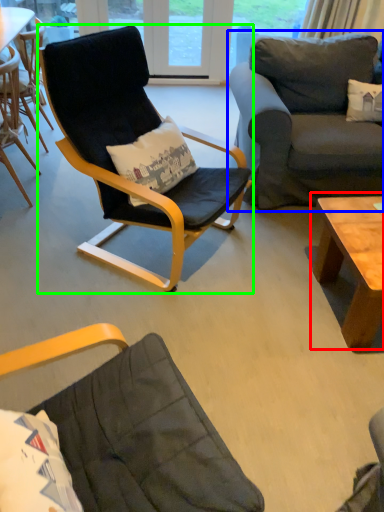
Question: Considering the real-world distances, which object is farthest from coffee table (highlighted by a red box)? studio couch (highlighted by a blue box) or chair (highlighted by a green box)?

Choices:
 (A) studio couch
 (B) chair

Answer: (B)